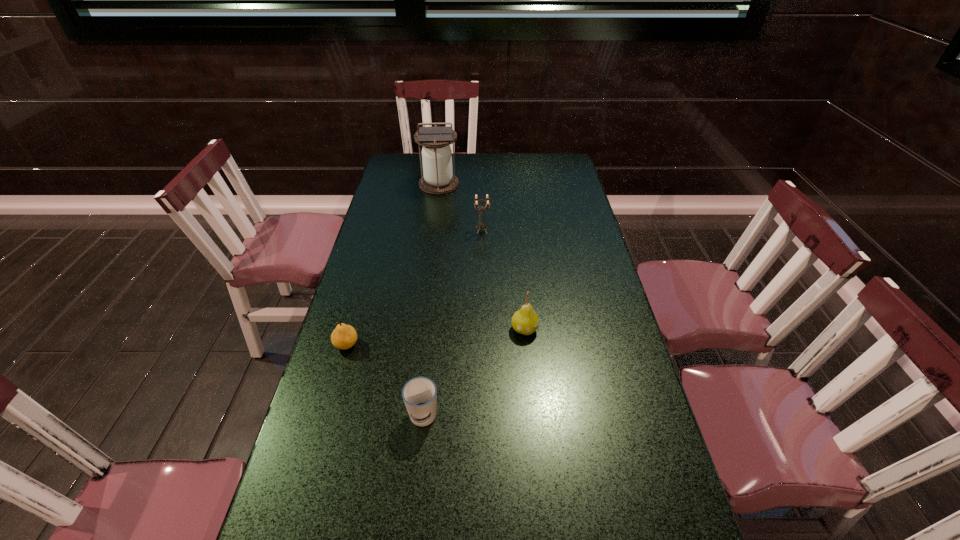
Choose which object is the second nearest neighbor to the farthest object. Please provide its 2D coordinates. Your answer should be formatted as a tuple, i.e. [(x, y)], where the tuple contains the x and y coordinates of a point satisfying the conditions above.

[(525, 321)]

You are a GUI agent. You are given a task and a screenshot of the screen. Output one action in this format:
    pyautogui.click(x=<x>, y=<y>)
    Task: Click on the free location that satisfies the following two spatial constraints: 1. on the front side of the tallest object; 2. on the right side of the rightmost object
    Image resolution: width=960 pixels, height=540 pixels.
    Given the screenshot: What is the action you would take?
    pyautogui.click(x=420, y=329)